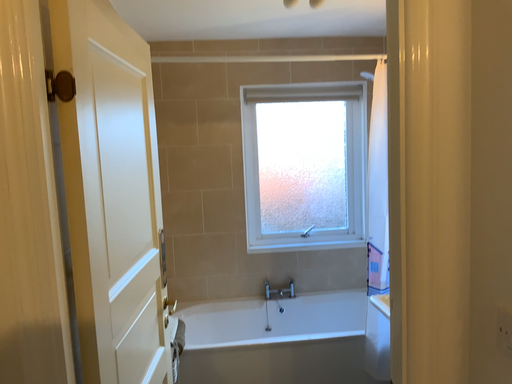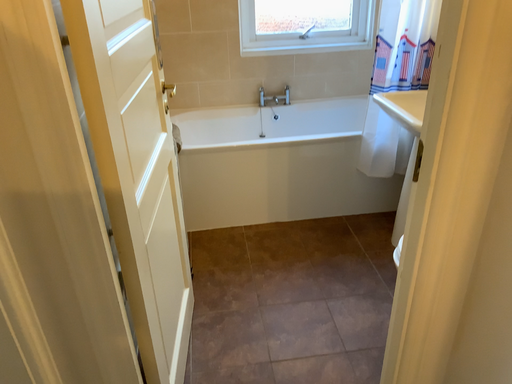
Question: How did the camera likely rotate when shooting the video?

Choices:
 (A) rotated downward
 (B) rotated upward

Answer: (A)